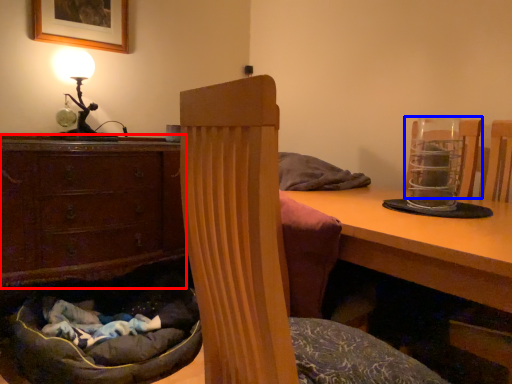
Question: Among these objects, which one is farthest to the camera, chest of drawers (highlighted by a red box) or armchair (highlighted by a blue box)?

Choices:
 (A) chest of drawers
 (B) armchair

Answer: (A)